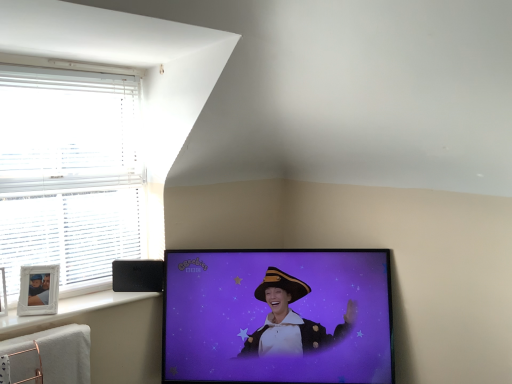
Identify the location of white plastic frame at lower left. The width and height of the screenshot is (512, 384). (67, 312).

The image size is (512, 384). I want to click on black glossy tv at center, so click(277, 316).

Is white plastic frame at lower left facing away from black glossy tv at center?

No, white plastic frame at lower left is not facing away from black glossy tv at center.

From the picture: Is white plastic frame at lower left behind black glossy tv at center?

No, it is in front of black glossy tv at center.

Between point (29, 316) and point (250, 365), which one is positioned behind?

The point (250, 365) is farther from the camera.

Is white plastic frame at lower left looking in the opposite direction of black plastic speaker at lower left?

No, white plastic frame at lower left's orientation is not away from black plastic speaker at lower left.

From the image's perspective, is white plastic frame at lower left located above black plastic speaker at lower left?

Incorrect, from the image's perspective, white plastic frame at lower left is lower than black plastic speaker at lower left.

Are white plastic frame at lower left and black plastic speaker at lower left located far from each other?

No, white plastic frame at lower left is in close proximity to black plastic speaker at lower left.

Considering the relative positions of white blinds at left and black glossy tv at center in the image provided, is white blinds at left to the right of black glossy tv at center from the viewer's perspective?

No.

Consider the image. Is white blinds at left inside the boundaries of black glossy tv at center, or outside?

white blinds at left lies outside black glossy tv at center.

From the picture: Is white blinds at left thinner than black glossy tv at center?

Indeed, white blinds at left has a lesser width compared to black glossy tv at center.

Considering the relative positions of black plastic speaker at lower left and white blinds at left in the image provided, is black plastic speaker at lower left to the left of white blinds at left from the viewer's perspective?

No.

Which object is wider, black plastic speaker at lower left or white blinds at left?

white blinds at left is wider.

This screenshot has height=384, width=512. What are the coordinates of `window that is above the black plastic speaker at lower left (from the image's perspective)` in the screenshot? It's located at pyautogui.click(x=69, y=171).

Which is closer to the camera, (130,286) or (167,311)?

Point (130,286) is positioned closer to the camera compared to point (167,311).

Based on the photo, who is more distant, black plastic speaker at lower left or black glossy tv at center?

black plastic speaker at lower left is more distant.

What's the angular difference between black plastic speaker at lower left and black glossy tv at center's facing directions?

Answer: 1.66 degrees.

Does point (122, 246) come farther from viewer compared to point (63, 321)?

Yes, point (122, 246) is farther from viewer.

Based on their sizes in the image, would you say white blinds at left is bigger or smaller than white plastic frame at lower left?

white blinds at left is bigger than white plastic frame at lower left.

How different are the orientations of white blinds at left and white plastic frame at lower left in degrees?

The angular difference between white blinds at left and white plastic frame at lower left is 0.25 degrees.

Choose the correct answer: Is white blinds at left inside white plastic frame at lower left or outside it?

white blinds at left is spatially situated outside white plastic frame at lower left.

Considering the relative positions of black plastic speaker at lower left and white plastic frame at lower left in the image provided, is black plastic speaker at lower left to the left of white plastic frame at lower left from the viewer's perspective?

No, black plastic speaker at lower left is not to the left of white plastic frame at lower left.

Does black plastic speaker at lower left have a smaller size compared to white plastic frame at lower left?

Yes, black plastic speaker at lower left is smaller than white plastic frame at lower left.

Does black plastic speaker at lower left touch white plastic frame at lower left?

No.

Is black plastic speaker at lower left oriented away from white plastic frame at lower left?

That's not correct — black plastic speaker at lower left is not looking away from white plastic frame at lower left.

This screenshot has height=384, width=512. In the image, there is a black glossy tv at center. What are the coordinates of `window sill above it (from the image's perspective)` in the screenshot? It's located at (67, 312).

The image size is (512, 384). Find the location of `window sill that appears in front of the black plastic speaker at lower left`. window sill that appears in front of the black plastic speaker at lower left is located at coordinates (67, 312).

From the image, which object appears to be farther from white plastic frame at lower left, black plastic speaker at lower left or black glossy tv at center?

black glossy tv at center.

From the image, which object appears to be farther from black glossy tv at center, black plastic speaker at lower left or white plastic frame at lower left?

The object further to black glossy tv at center is white plastic frame at lower left.

Based on their spatial positions, is black glossy tv at center or black plastic speaker at lower left closer to white blinds at left?

black plastic speaker at lower left.

Which object lies further to the anchor point white blinds at left, black plastic speaker at lower left or black glossy tv at center?

black glossy tv at center lies further to white blinds at left than the other object.

Estimate the real-world distances between objects in this image. Which object is closer to black plastic speaker at lower left, white blinds at left or white plastic frame at lower left?

white plastic frame at lower left is closer to black plastic speaker at lower left.

Which object lies further to the anchor point white plastic frame at lower left, black glossy tv at center or black plastic speaker at lower left?

black glossy tv at center lies further to white plastic frame at lower left than the other object.

Looking at the image, which one is located closer to black plastic speaker at lower left, white plastic frame at lower left or white blinds at left?

The object closer to black plastic speaker at lower left is white plastic frame at lower left.

When comparing their distances from white plastic frame at lower left, does white blinds at left or black glossy tv at center seem closer?

Among the two, white blinds at left is located nearer to white plastic frame at lower left.

Locate an element on the screen. speaker between white plastic frame at lower left and black glossy tv at center from left to right is located at coordinates (138, 275).

You are a GUI agent. You are given a task and a screenshot of the screen. Output one action in this format:
    pyautogui.click(x=<x>, y=<y>)
    Task: Click on the window sill located between white blinds at left and black glossy tv at center in the left-right direction
    This screenshot has height=384, width=512.
    Given the screenshot: What is the action you would take?
    pyautogui.click(x=67, y=312)

Where is `speaker between white blinds at left and white plastic frame at lower left in the up-down direction`? The height and width of the screenshot is (384, 512). speaker between white blinds at left and white plastic frame at lower left in the up-down direction is located at coordinates (138, 275).

You are a GUI agent. You are given a task and a screenshot of the screen. Output one action in this format:
    pyautogui.click(x=<x>, y=<y>)
    Task: Click on the speaker between white blinds at left and black glossy tv at center in the horizontal direction
    Image resolution: width=512 pixels, height=384 pixels.
    Given the screenshot: What is the action you would take?
    pyautogui.click(x=138, y=275)